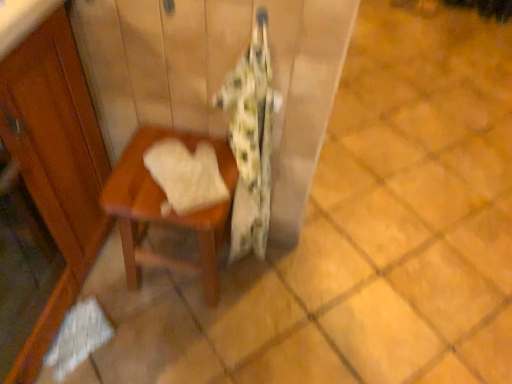
Question: Does fluffy white blanket at center have a larger size compared to wooden table at center?

Choices:
 (A) yes
 (B) no

Answer: (B)

Question: Is fluffy white blanket at center positioned behind wooden table at center?

Choices:
 (A) no
 (B) yes

Answer: (A)

Question: Is fluffy white blanket at center far from wooden table at center?

Choices:
 (A) yes
 (B) no

Answer: (B)

Question: From a real-world perspective, is fluffy white blanket at center physically below wooden table at center?

Choices:
 (A) yes
 (B) no

Answer: (B)

Question: Can wooden table at center be found inside fluffy white blanket at center?

Choices:
 (A) yes
 (B) no

Answer: (B)

Question: Can you confirm if fluffy white blanket at center is thinner than wooden table at center?

Choices:
 (A) no
 (B) yes

Answer: (B)

Question: Does white soft towel at center appear on the right side of wooden table at center?

Choices:
 (A) no
 (B) yes

Answer: (B)

Question: Is white soft towel at center with wooden table at center?

Choices:
 (A) yes
 (B) no

Answer: (B)

Question: From the image's perspective, is white soft towel at center on top of wooden table at center?

Choices:
 (A) no
 (B) yes

Answer: (B)

Question: Is white soft towel at center smaller than wooden table at center?

Choices:
 (A) no
 (B) yes

Answer: (B)

Question: Considering the relative sizes of white soft towel at center and wooden table at center in the image provided, is white soft towel at center taller than wooden table at center?

Choices:
 (A) no
 (B) yes

Answer: (A)

Question: Is white soft towel at center positioned beyond the bounds of wooden table at center?

Choices:
 (A) yes
 (B) no

Answer: (A)

Question: From the image's perspective, is fluffy white blanket at center below white soft towel at center?

Choices:
 (A) no
 (B) yes

Answer: (B)